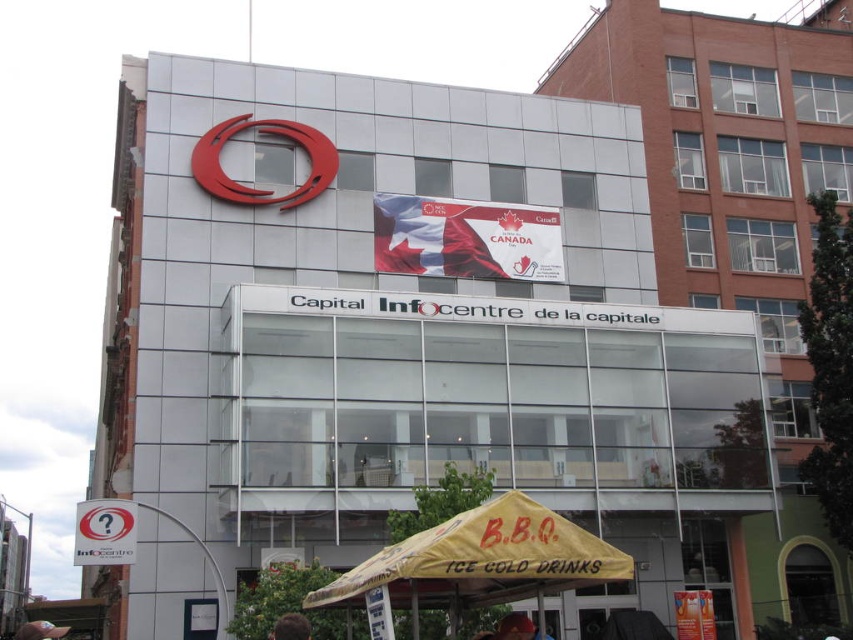
Who is positioned more to the right, white paper sign at lower left or brown hair at lower center?

From the viewer's perspective, brown hair at lower center appears more on the right side.

Does point (106, 536) lie in front of point (289, 628)?

No, it is not.

Locate an element on the screen. white paper sign at lower left is located at coordinates (105, 532).

Is point (428, 572) positioned behind point (521, 625)?

No, it is not.

Is point (486, 544) positioned behind point (549, 636)?

No, (486, 544) is in front of (549, 636).

Locate an element on the screen. The width and height of the screenshot is (853, 640). yellow fabric umbrella at lower center is located at coordinates (477, 563).

Describe the element at coordinates (291, 627) in the screenshot. This screenshot has height=640, width=853. I see `brown hair at lower center` at that location.

Is brown hair at lower center positioned before pink fabric cap at lower left?

Yes.

This screenshot has height=640, width=853. Describe the element at coordinates (291, 627) in the screenshot. I see `brown hair at lower center` at that location.

Where is `brown hair at lower center`? The width and height of the screenshot is (853, 640). brown hair at lower center is located at coordinates (291, 627).